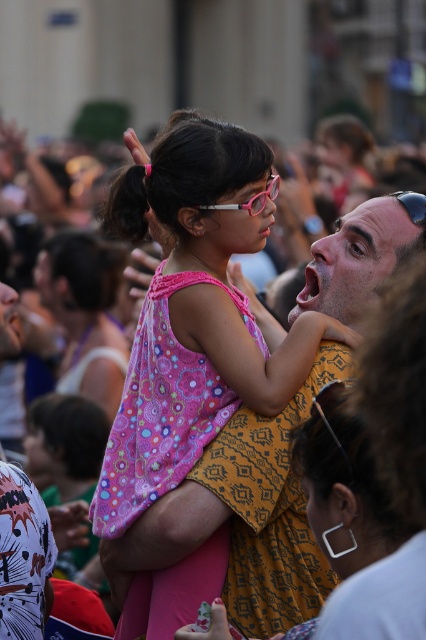
What are the coordinates of the pink plastic glasses at center?

The coordinates of the pink plastic glasses at center are at point [250,198].

You are standing at the event and want to hand a gift to the person wearing the pink fabric dress at center. Considering the distance, can you reach them without moving closer?

The pink fabric dress at center is 144.44 feet away from you, so you cannot reach them without moving closer.